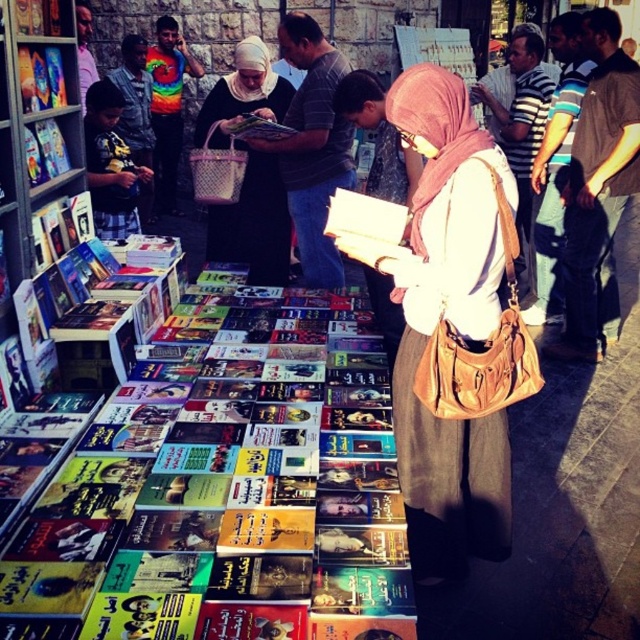
You are standing at the entrance of the outdoor book market and see two points in the scene. The first point is at coordinate point [305,100] and the second is at point [220,216]. Which point is closer to you?

Point [305,100] is in front of point [220,216], so the first point is closer to you.

You are a photographer trying to capture the woman in the scene. You notice the matte beige scarf at center and the matte black shirt at center. Which item is closer to the camera lens?

The matte beige scarf at center is positioned under the matte black shirt at center, so the scarf is closer to the camera lens because it is beneath the shirt.